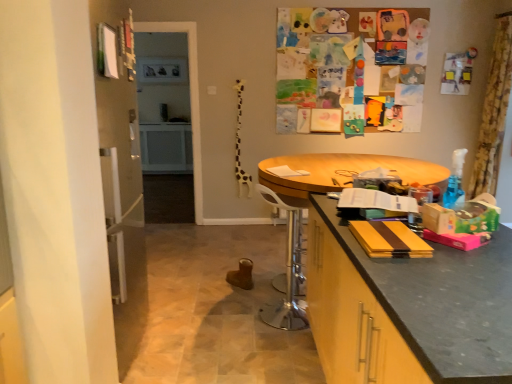
Find the location of `free space that is in between wooden round table at center and white plastic swivel chair at center`. free space that is in between wooden round table at center and white plastic swivel chair at center is located at coordinates (253, 312).